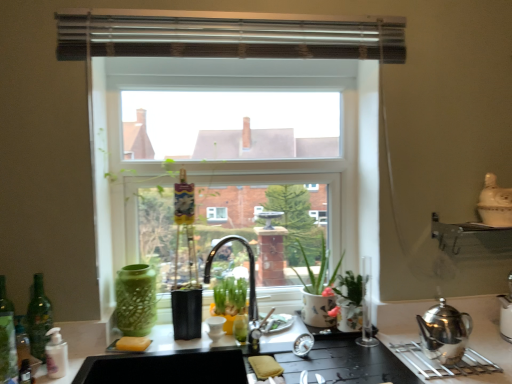
Question: Is clear glass window at center surrounded by white matte bottle at lower left, the 3th bottle viewed from the left?

Choices:
 (A) no
 (B) yes

Answer: (A)

Question: Is white matte bottle at lower left, the 1th bottle from the right, not inside clear glass window at center?

Choices:
 (A) yes
 (B) no

Answer: (A)

Question: Is white matte bottle at lower left, the 1th bottle from the right, bigger than clear glass window at center?

Choices:
 (A) no
 (B) yes

Answer: (A)

Question: From the image's perspective, would you say white matte bottle at lower left, the 3th bottle viewed from the left, is shown under clear glass window at center?

Choices:
 (A) no
 (B) yes

Answer: (B)

Question: Does white matte bottle at lower left, the 3th bottle viewed from the left, have a lesser width compared to clear glass window at center?

Choices:
 (A) no
 (B) yes

Answer: (A)

Question: Would you say white ceramic vase at upper right is inside or outside metallic silver exhaust hood at upper center?

Choices:
 (A) inside
 (B) outside

Answer: (B)

Question: In terms of width, does white ceramic vase at upper right look wider or thinner when compared to metallic silver exhaust hood at upper center?

Choices:
 (A) wide
 (B) thin

Answer: (A)

Question: Would you say white ceramic vase at upper right is to the left or to the right of metallic silver exhaust hood at upper center in the picture?

Choices:
 (A) left
 (B) right

Answer: (B)

Question: Considering the positions of white ceramic vase at upper right and metallic silver exhaust hood at upper center in the image, is white ceramic vase at upper right taller or shorter than metallic silver exhaust hood at upper center?

Choices:
 (A) short
 (B) tall

Answer: (B)

Question: Considering the relative positions of green glass bottle at left, the 3th bottle positioned from the right, and silver metallic teapot at right in the image provided, is green glass bottle at left, the 3th bottle positioned from the right, to the left or to the right of silver metallic teapot at right?

Choices:
 (A) left
 (B) right

Answer: (A)

Question: Looking at their shapes, would you say green glass bottle at left, arranged as the 1th bottle when viewed from the left, is wider or thinner than silver metallic teapot at right?

Choices:
 (A) thin
 (B) wide

Answer: (A)

Question: Is green glass bottle at left, arranged as the 1th bottle when viewed from the left, taller or shorter than silver metallic teapot at right?

Choices:
 (A) short
 (B) tall

Answer: (B)

Question: From a real-world perspective, relative to silver metallic teapot at right, is green glass bottle at left, arranged as the 1th bottle when viewed from the left, vertically above or below?

Choices:
 (A) below
 (B) above

Answer: (B)

Question: Which is correct: green glass bottle at left, the 3th bottle positioned from the right, is inside yellow matte sponge at lower center, or outside of it?

Choices:
 (A) inside
 (B) outside

Answer: (B)

Question: In terms of size, does green glass bottle at left, arranged as the 1th bottle when viewed from the left, appear bigger or smaller than yellow matte sponge at lower center?

Choices:
 (A) small
 (B) big

Answer: (B)